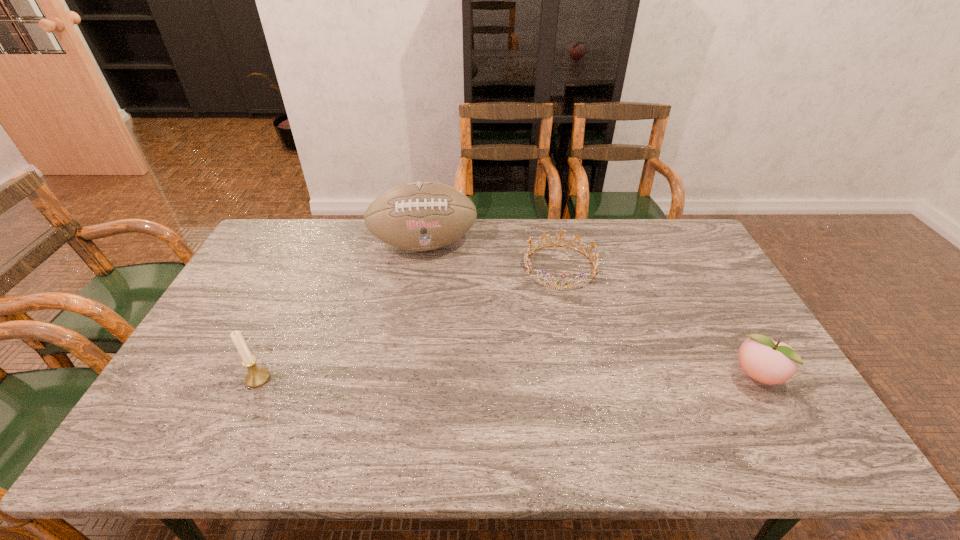
You are a GUI agent. You are given a task and a screenshot of the screen. Output one action in this format:
    pyautogui.click(x=<x>, y=<y>)
    Task: Click on the blank space located 0.360m on the front-facing side of the third object from left to right
    This screenshot has width=960, height=540.
    Given the screenshot: What is the action you would take?
    pyautogui.click(x=564, y=389)

Find the location of a particular element. vacant position located 0.260m on the front-facing side of the third object from left to right is located at coordinates (564, 358).

You are a GUI agent. You are given a task and a screenshot of the screen. Output one action in this format:
    pyautogui.click(x=<x>, y=<y>)
    Task: Click on the free space located on the front-facing side of the third object from left to right
    The width and height of the screenshot is (960, 540).
    Given the screenshot: What is the action you would take?
    pyautogui.click(x=562, y=313)

Locate an element on the screen. Image resolution: width=960 pixels, height=540 pixels. vacant space situated 0.360m on the laces of the football (American) is located at coordinates (447, 346).

Where is `vacant region located 0.320m on the laces of the football (American)`? The width and height of the screenshot is (960, 540). vacant region located 0.320m on the laces of the football (American) is located at coordinates (445, 335).

Where is `vacant area located 0.070m on the laces of the football (American)`? vacant area located 0.070m on the laces of the football (American) is located at coordinates (434, 278).

Where is `tiara that is at the far edge`? Image resolution: width=960 pixels, height=540 pixels. tiara that is at the far edge is located at coordinates (527, 261).

In order to click on football (American) that is at the far edge in this screenshot , I will do `click(418, 216)`.

Where is `candle holder located at the near edge`? This screenshot has width=960, height=540. candle holder located at the near edge is located at coordinates (257, 376).

At what (x,y) coordinates should I click in order to perform the action: click on peach at the near edge. Please return your answer as a coordinate pair (x, y). The image size is (960, 540). Looking at the image, I should click on (761, 358).